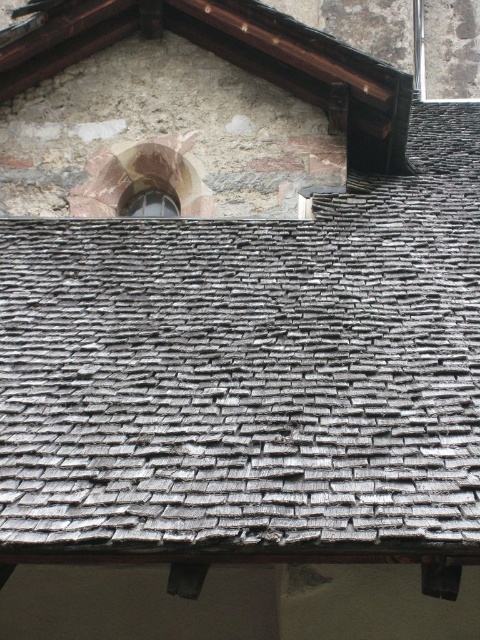
You are an architect inspecting a building. You notice the weathered wood shingles at upper center and the matte glass window at upper center. Which object takes up more space in the image?

The weathered wood shingles at upper center take up more space in the image because they are larger in size than the matte glass window at upper center.

You are a maintenance worker assessing the roof of a historic building. You notice the weathered wood shingles at upper center and the matte glass window at upper center. Given that the minimum safe distance between the edge of the roof and any window for structural integrity is 20 feet, is the current spacing between these two elements compliant with safety standards?

The weathered wood shingles at upper center and the matte glass window at upper center are 22.61 feet apart, which exceeds the minimum required 20 feet distance. Therefore, the current spacing is compliant with safety standards.

Consider the image. You are standing on the ground looking up at the building. Which object is closer to you between the weathered wood shingles at upper center and the matte glass window at upper center?

The weathered wood shingles at upper center are closer to the viewer than the matte glass window at upper center.